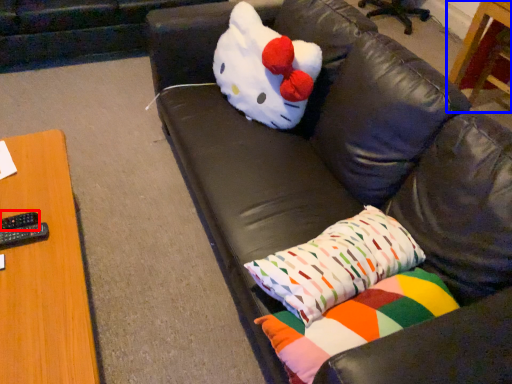
Question: Which object is closer to the camera taking this photo, remote (highlighted by a red box) or table (highlighted by a blue box)?

Choices:
 (A) remote
 (B) table

Answer: (A)